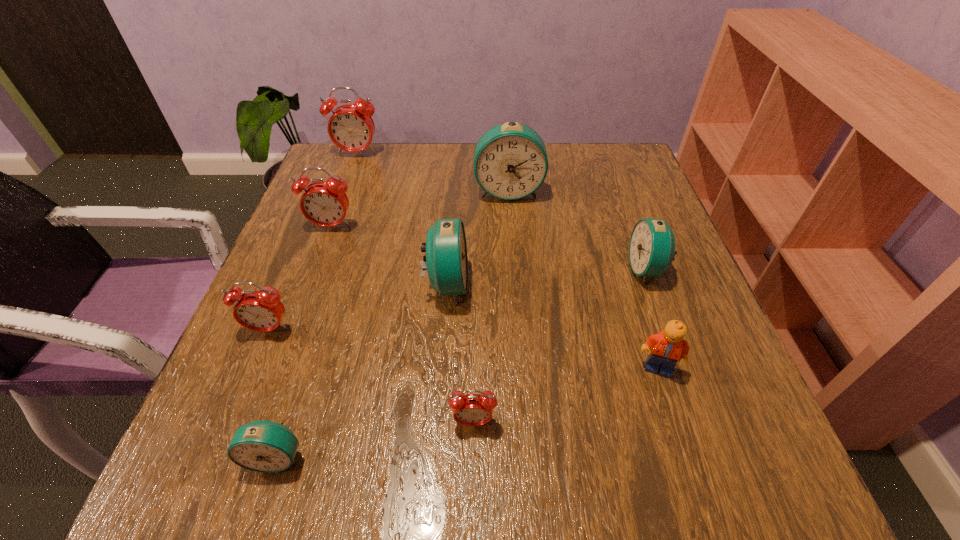
Locate an element on the screen. the farthest object is located at coordinates click(x=350, y=127).

Identify the location of the biggest red alarm clock. (350, 127).

Locate an element on the screen. The width and height of the screenshot is (960, 540). the seventh nearest alarm clock is located at coordinates (510, 161).

Find the location of a particular element. the second farthest object is located at coordinates (510, 161).

Identify the location of the second blue alarm clock from left to right. (446, 258).

Image resolution: width=960 pixels, height=540 pixels. What are the coordinates of `the second farthest red alarm clock` in the screenshot? It's located at (325, 204).

Where is `the second biggest red alarm clock`? The height and width of the screenshot is (540, 960). the second biggest red alarm clock is located at coordinates (325, 204).

Find the location of a particular element. The image size is (960, 540). the third biggest blue alarm clock is located at coordinates (652, 243).

Find the location of a particular element. The image size is (960, 540). the rightmost blue alarm clock is located at coordinates pos(652,243).

At what (x,y) coordinates should I click in order to perform the action: click on the third farthest red alarm clock. Please return your answer as a coordinate pair (x, y). The image size is (960, 540). Looking at the image, I should click on (262, 311).